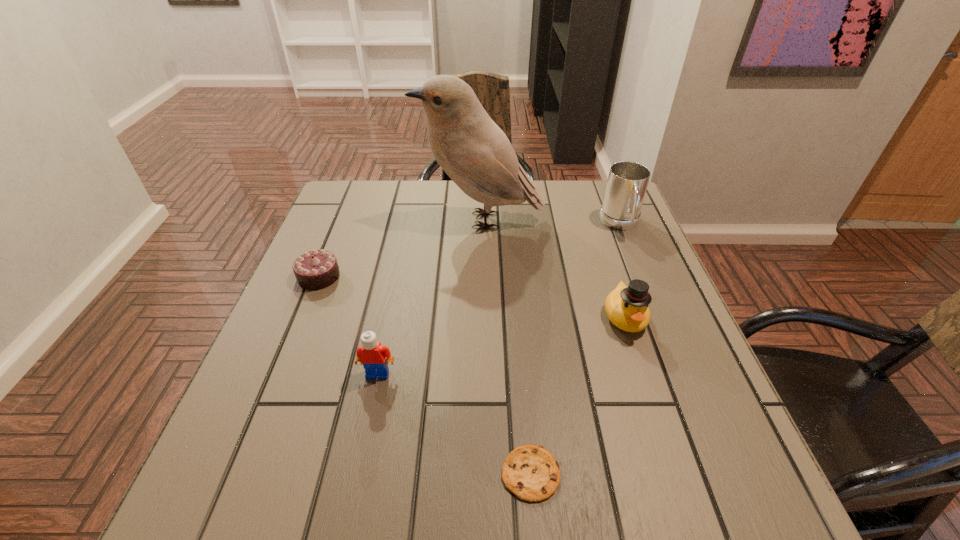
You are a GUI agent. You are given a task and a screenshot of the screen. Output one action in this format:
    pyautogui.click(x=<x>, y=<y>)
    Task: Click on the blank space located on the face of the parakeet
    
    Given the screenshot: What is the action you would take?
    pyautogui.click(x=335, y=220)

You are a GUI agent. You are given a task and a screenshot of the screen. Output one action in this format:
    pyautogui.click(x=<x>, y=<y>)
    Task: Click on the vacant space located 0.130m on the side of the second tallest object with the handle
    The height and width of the screenshot is (540, 960).
    Given the screenshot: What is the action you would take?
    pyautogui.click(x=641, y=274)

At what (x,y) coordinates should I click in order to perform the action: click on blank area located 0.100m on the face of the Lego. Please return your answer as a coordinate pair (x, y). The height and width of the screenshot is (540, 960). Looking at the image, I should click on (x=366, y=429).

At what (x,y) coordinates should I click in order to perform the action: click on vacant space located 0.270m on the front-facing side of the fourth farthest object. Please return your answer as a coordinate pair (x, y). The width and height of the screenshot is (960, 540). Looking at the image, I should click on (677, 474).

Find the location of a particular element. The image size is (960, 540). vacant space located on the front of the chocolate cake is located at coordinates (257, 428).

You are a GUI agent. You are given a task and a screenshot of the screen. Output one action in this format:
    pyautogui.click(x=<x>, y=<y>)
    Task: Click on the vacant space located 0.320m on the left of the nearest object
    The image size is (960, 540).
    Given the screenshot: What is the action you would take?
    pyautogui.click(x=300, y=473)

Image resolution: width=960 pixels, height=540 pixels. What are the coordinates of `parakeet at the far edge` in the screenshot? It's located at (474, 152).

Find the location of a particular element. This screenshot has width=960, height=540. mug located in the far edge section of the desktop is located at coordinates (627, 182).

Find the location of a particular element. object that is at the near edge is located at coordinates (530, 471).

This screenshot has height=540, width=960. I want to click on object that is positioned at the left edge, so click(317, 269).